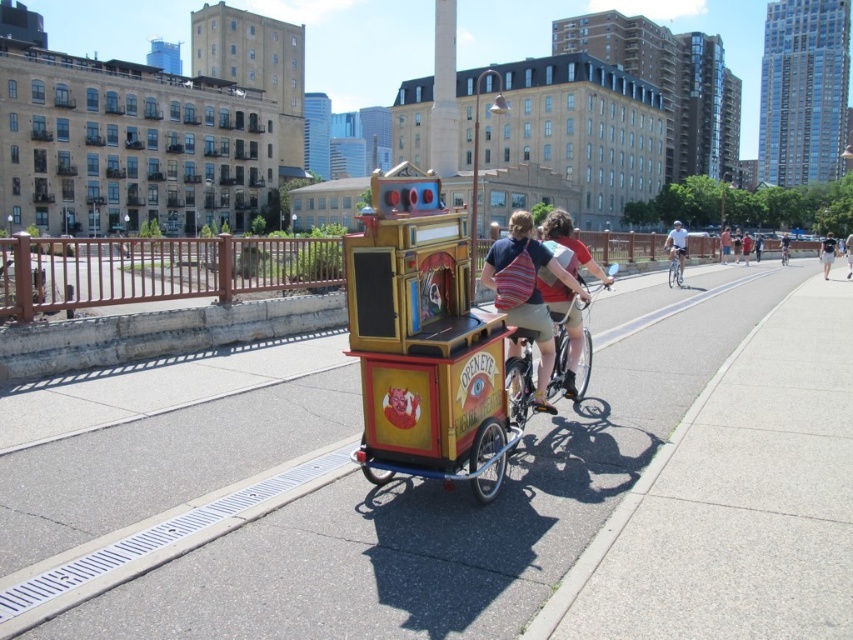
Question: Can you confirm if wooden painted cart at center is positioned below light blue denim shorts at center?

Choices:
 (A) yes
 (B) no

Answer: (A)

Question: Which of the following is the farthest from the observer?

Choices:
 (A) red cotton shirt at center
 (B) wooden painted cart at center
 (C) striped t-shirt at center
 (D) striped fabric backpack at center

Answer: (A)

Question: Which object is the closest to the striped fabric backpack at center?

Choices:
 (A) wooden bike lane at center
 (B) white cotton shirt at center
 (C) metallic silver bicycle at center

Answer: (C)

Question: Is striped fabric backpack at center to the right of white cotton shirt at center from the viewer's perspective?

Choices:
 (A) yes
 (B) no

Answer: (B)

Question: Can you confirm if striped fabric backpack at center is wider than light brown leather jacket at center?

Choices:
 (A) yes
 (B) no

Answer: (B)

Question: Which of the following is the farthest from the observer?

Choices:
 (A) red cotton shirt at center
 (B) striped t-shirt at center
 (C) wooden bike lane at center

Answer: (A)